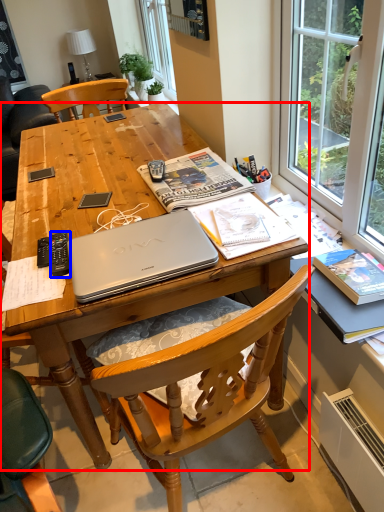
Question: Among these objects, which one is farthest to the camera, desk (highlighted by a red box) or remote control (highlighted by a blue box)?

Choices:
 (A) desk
 (B) remote control

Answer: (B)